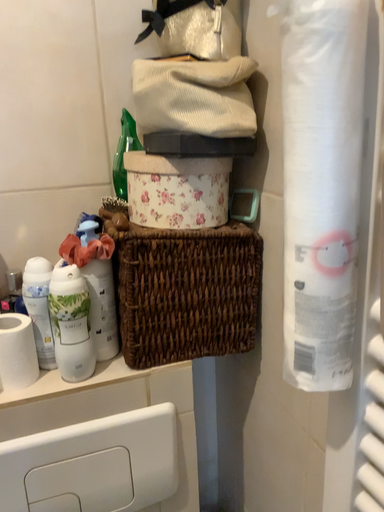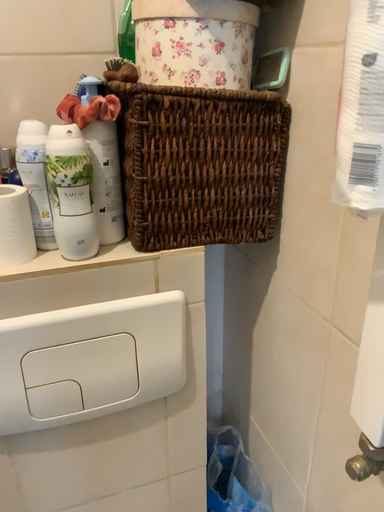
Question: How did the camera likely rotate when shooting the video?

Choices:
 (A) rotated downward
 (B) rotated upward

Answer: (A)